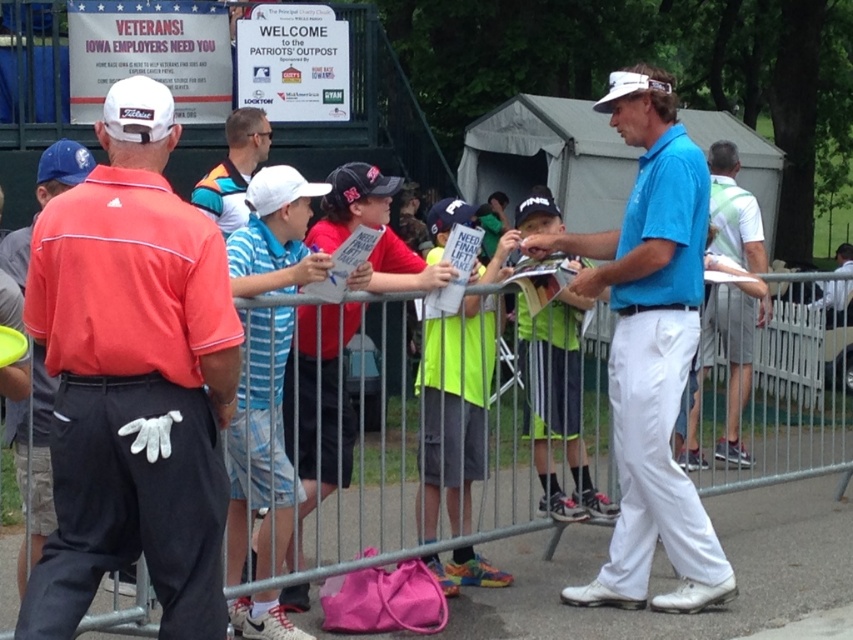
Is point (723, 214) positioned before point (7, 432)?

No.

In the scene shown: Does blue shirt at center appear on the right side of matte orange polo shirt at left?

Yes, blue shirt at center is to the right of matte orange polo shirt at left.

Who is more distant from viewer, (738, 221) or (49, 172)?

Point (738, 221)

Where is `blue shirt at center`? The height and width of the screenshot is (640, 853). blue shirt at center is located at coordinates (730, 358).

Which is more to the left, blue smooth shirt at center or orange shirt at center?

orange shirt at center is more to the left.

Does blue smooth shirt at center have a greater height compared to orange shirt at center?

Yes.

Which is behind, point (660, 344) or point (242, 157)?

The point (242, 157) is behind.

Identify the location of blue smooth shirt at center. (650, 349).

Can you confirm if matte white cap at left is positioned to the left of blue smooth shirt at center?

Correct, you'll find matte white cap at left to the left of blue smooth shirt at center.

Can you confirm if matte white cap at left is taller than blue smooth shirt at center?

No.

Identify the location of matte white cap at left. This screenshot has width=853, height=640. (132, 380).